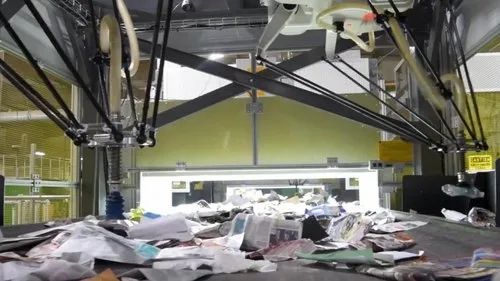
Where is `light`? The width and height of the screenshot is (500, 281). light is located at coordinates (213, 56).